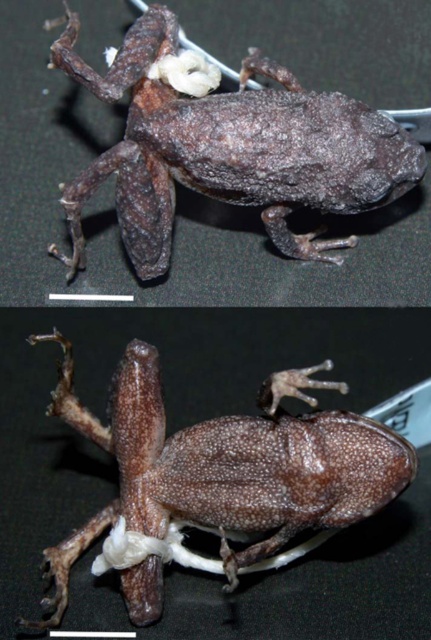
Question: Which point appears closest to the camera in this image?

Choices:
 (A) (209, 445)
 (B) (137, 195)

Answer: (A)

Question: Can you confirm if fuzzy brown frog at center is positioned below brown matte frog at center?

Choices:
 (A) no
 (B) yes

Answer: (A)

Question: Which point appears farthest from the camera in this image?

Choices:
 (A) (191, 497)
 (B) (324, 97)

Answer: (B)

Question: Is fuzzy brown frog at center closer to the viewer compared to brown matte frog at center?

Choices:
 (A) yes
 (B) no

Answer: (B)

Question: Does fuzzy brown frog at center have a lesser width compared to brown matte frog at center?

Choices:
 (A) no
 (B) yes

Answer: (A)